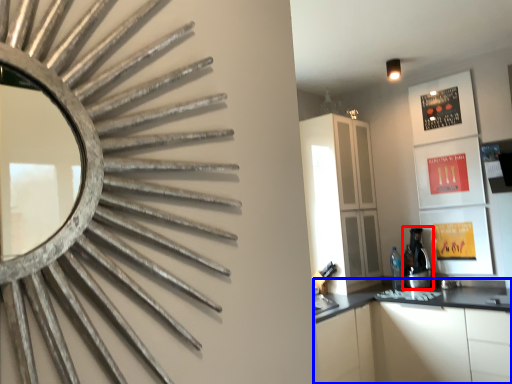
Question: Which object appears farthest to the camera in this image, coffee machine (highlighted by a red box) or cabinetry (highlighted by a blue box)?

Choices:
 (A) coffee machine
 (B) cabinetry

Answer: (A)